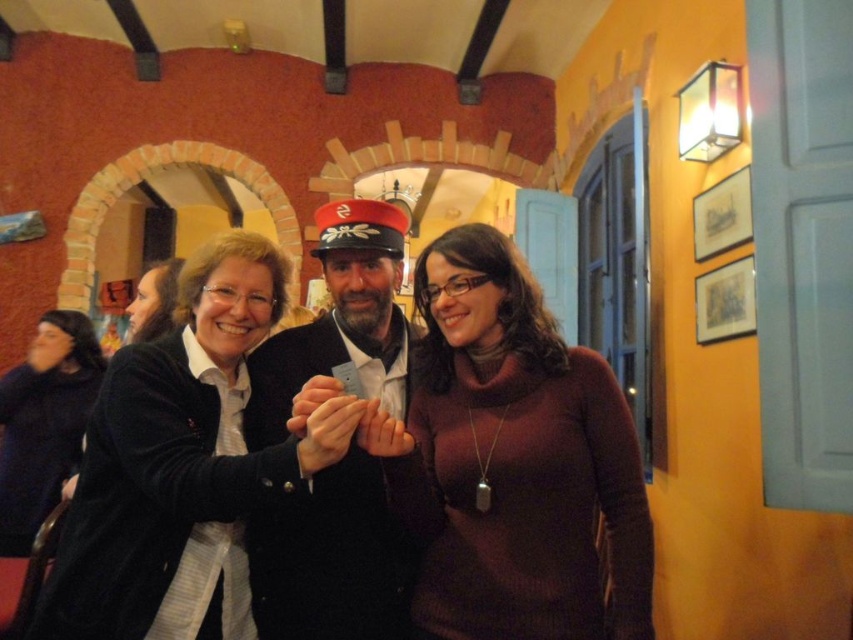
You are a photographer trying to capture a closeup of the two points in the image. Which point, point (525, 544) or point (39, 435), is better suited for a closeup shot without needing to adjust your camera focus?

Point (525, 544) is closer to the camera than point (39, 435), so it is better suited for a closeup shot without needing to adjust your camera focus.

You are organizing a charity event and need to arrange seating based on the height of attendees. You have two people wearing the burgundy sweater at center and dark blue sweater at left. Which person should you seat at a lower table to accommodate their height?

The burgundy sweater at center has a lesser height compared to the dark blue sweater at left, so they should be seated at the lower table to accommodate their height.